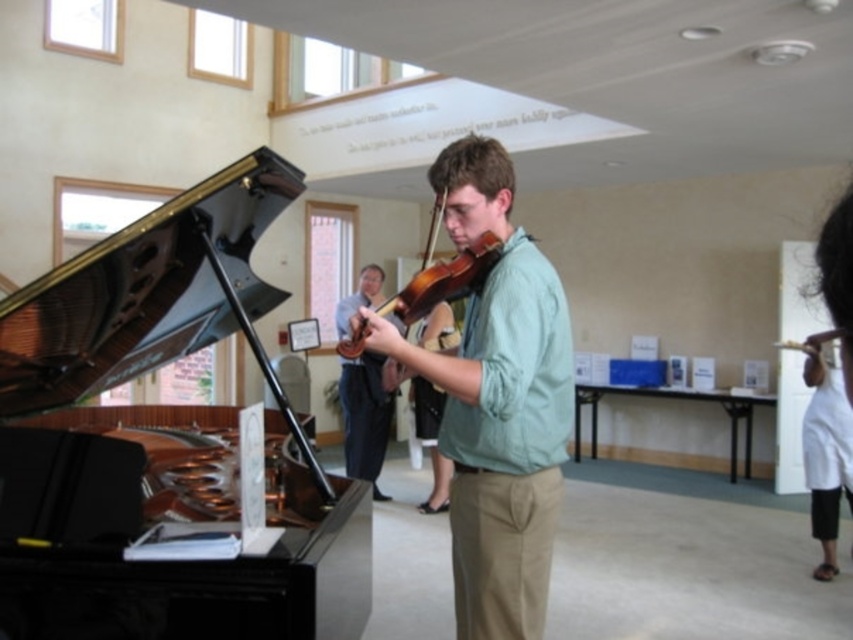
Question: Estimate the real-world distances between objects in this image. Which object is farther from the khaki cotton pants at center?

Choices:
 (A) black polished piano at left
 (B) wooden violin at center
 (C) matte green shirt at center

Answer: (C)

Question: Which object appears closest to the camera in this image?

Choices:
 (A) black polished piano at left
 (B) wooden violin at center

Answer: (A)

Question: Can you confirm if black polished piano at left is positioned to the left of matte green shirt at center?

Choices:
 (A) no
 (B) yes

Answer: (B)

Question: Estimate the real-world distances between objects in this image. Which object is closer to the wooden violin at center?

Choices:
 (A) matte green shirt at center
 (B) black polished piano at left

Answer: (B)

Question: Is black polished piano at left to the left of khaki cotton pants at center from the viewer's perspective?

Choices:
 (A) yes
 (B) no

Answer: (A)

Question: In this image, where is black polished piano at left located relative to khaki cotton pants at center?

Choices:
 (A) below
 (B) above

Answer: (A)